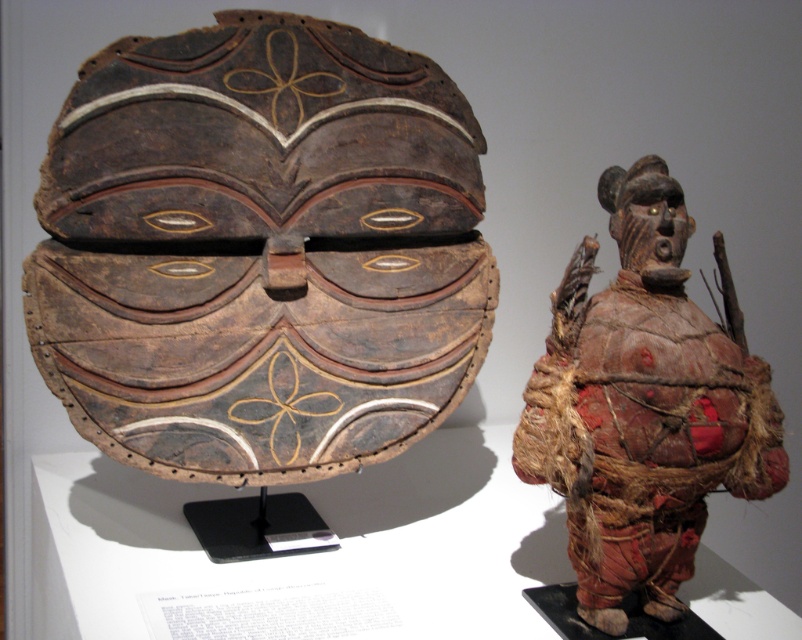
You are a museum curator planning to install a new exhibit. The brown carved wood helmet at upper left is displayed at coordinates point 0.392, 0.324. If you want to place a label next to it, where should you position the label relative to the helmet?

The label should be positioned to the right of the brown carved wood helmet at upper left since it is located at point (258, 250), which is on the upper left side of the image. Placing the label to the right would ensure it is clearly visible next to the artifact.

You are a museum curator arranging an exhibition. You need to place a label next to each artifact. The label for the brown carved wood helmet at upper left must be placed in front of the brown textured cloth warrior at right. Is this possible given their current positions?

The brown textured cloth warrior at right is behind the brown carved wood helmet at upper left, so placing the label for the brown carved wood helmet at upper left in front of the brown textured cloth warrior at right is possible as they are positioned that way.

You are a museum curator planning to display the brown carved wood helmet at upper left and the brown textured cloth warrior at right in a new exhibition. The display case has a height limit of 1 meter. Can both items fit vertically if placed side by side?

The brown carved wood helmet at upper left is larger than the brown textured cloth warrior at right. Since the display case has a height limit of 1 meter, and the helmet is the larger item, it is possible that both items can fit vertically if placed side by side, provided the combined height does not exceed the limit. However, without specific height measurements, it is recommended to check the exact dimensions of both items to ensure they meet the display case requirements.